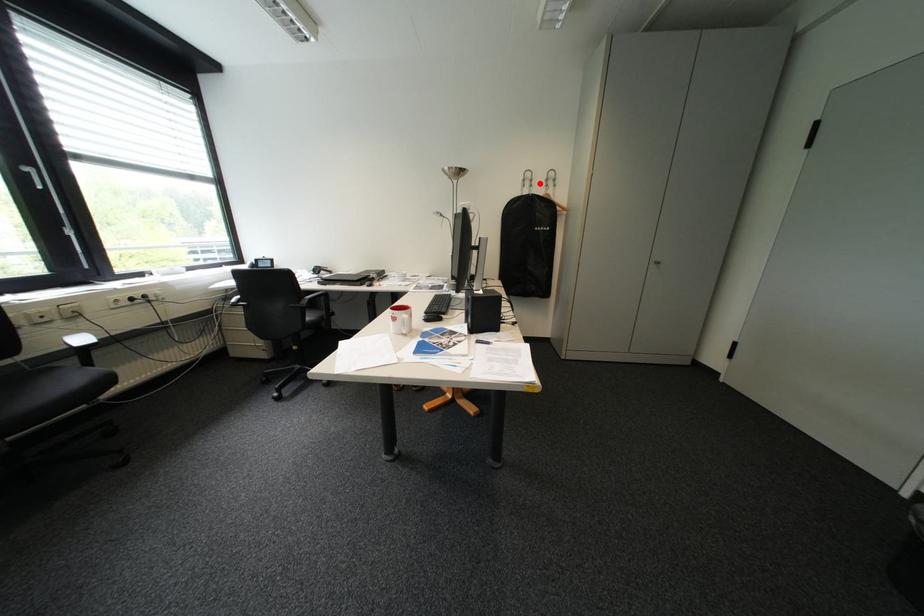
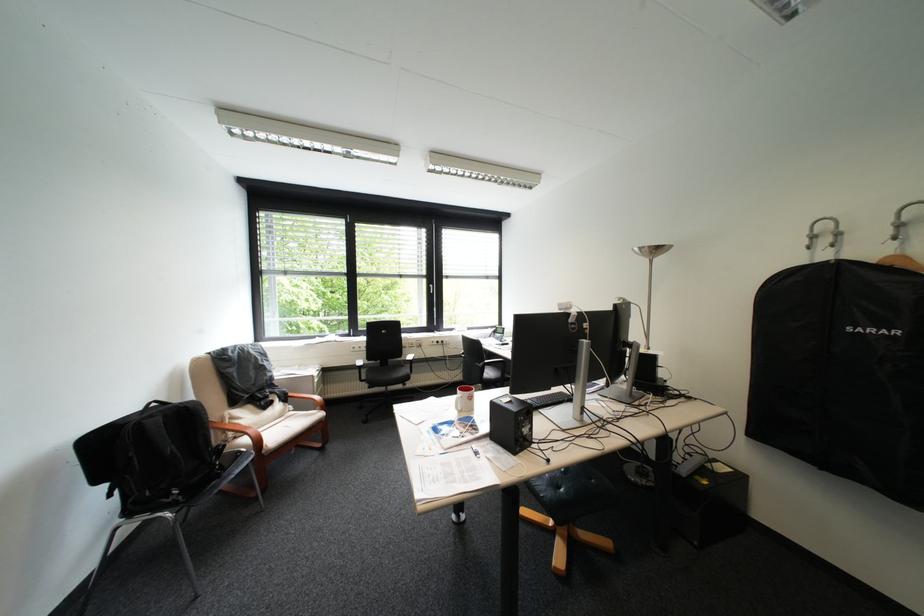
Question: I am providing you with two images of the same scene from different viewpoints. Image1 has a red point marked. In image2, the corresponding 3D location appears at what relative position? Reply with the corresponding letter.

Choices:
 (A) Closer
 (B) Farther

Answer: (B)